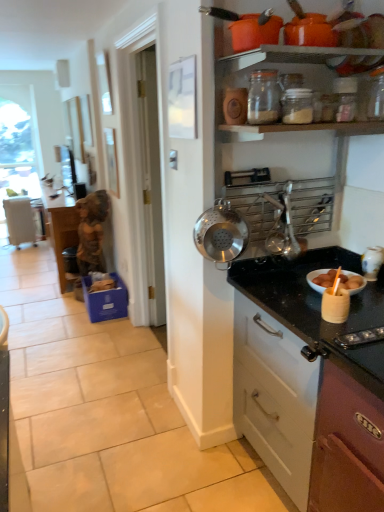
Question: Is clear glass jar at upper center, which is the second kitchen appliance from top to bottom, looking in the opposite direction of black granite countertop at right?

Choices:
 (A) yes
 (B) no

Answer: (B)

Question: Is clear glass jar at upper center, positioned as the second kitchen appliance in bottom-to-top order, positioned beyond the bounds of black granite countertop at right?

Choices:
 (A) no
 (B) yes

Answer: (B)

Question: From a real-world perspective, is clear glass jar at upper center, positioned as the second kitchen appliance in bottom-to-top order, beneath black granite countertop at right?

Choices:
 (A) no
 (B) yes

Answer: (A)

Question: From the image's perspective, would you say clear glass jar at upper center, positioned as the second kitchen appliance in bottom-to-top order, is positioned over black granite countertop at right?

Choices:
 (A) yes
 (B) no

Answer: (A)

Question: Can you confirm if clear glass jar at upper center, positioned as the second kitchen appliance in bottom-to-top order, is bigger than black granite countertop at right?

Choices:
 (A) yes
 (B) no

Answer: (B)

Question: Is clear glass jar at upper center, positioned as the second kitchen appliance in bottom-to-top order, thinner than black granite countertop at right?

Choices:
 (A) no
 (B) yes

Answer: (B)

Question: Is clear glass jar at upper center, which is the third kitchen appliance in bottom-to-top order, turned away from stainless steel colander at upper right, arranged as the 3th kitchen appliance when viewed from the top?

Choices:
 (A) no
 (B) yes

Answer: (A)

Question: Is clear glass jar at upper center, which is the third kitchen appliance in bottom-to-top order, oriented towards stainless steel colander at upper right, arranged as the 3th kitchen appliance when viewed from the top?

Choices:
 (A) no
 (B) yes

Answer: (A)

Question: From the image's perspective, does clear glass jar at upper center, arranged as the 1th kitchen appliance when viewed from the top, appear lower than stainless steel colander at upper right, arranged as the 3th kitchen appliance when viewed from the top?

Choices:
 (A) yes
 (B) no

Answer: (B)

Question: Is clear glass jar at upper center, which is the third kitchen appliance in bottom-to-top order, to the right of stainless steel colander at upper right, arranged as the 3th kitchen appliance when viewed from the top, from the viewer's perspective?

Choices:
 (A) no
 (B) yes

Answer: (B)

Question: From a real-world perspective, is clear glass jar at upper center, which is the third kitchen appliance in bottom-to-top order, physically above stainless steel colander at upper right, arranged as the 3th kitchen appliance when viewed from the top?

Choices:
 (A) yes
 (B) no

Answer: (A)

Question: Is clear glass jar at upper center, arranged as the 1th kitchen appliance when viewed from the top, shorter than stainless steel colander at upper right, which appears as the first kitchen appliance when ordered from the bottom?

Choices:
 (A) yes
 (B) no

Answer: (A)

Question: From a real-world perspective, is clear glass jar at upper center, which is the third kitchen appliance in bottom-to-top order, on metallic silver utensil rack at upper center?

Choices:
 (A) no
 (B) yes

Answer: (B)